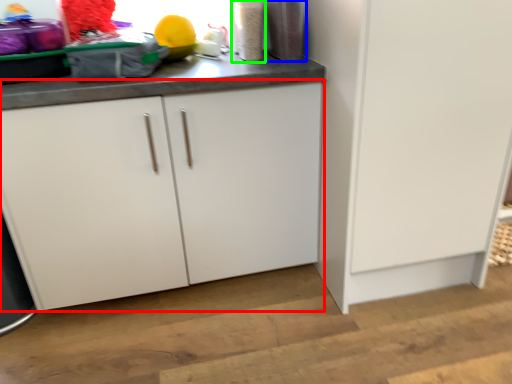
Question: Which is farther away from cabinetry (highlighted by a red box)? appliance (highlighted by a blue box) or appliance (highlighted by a green box)?

Choices:
 (A) appliance
 (B) appliance

Answer: (A)